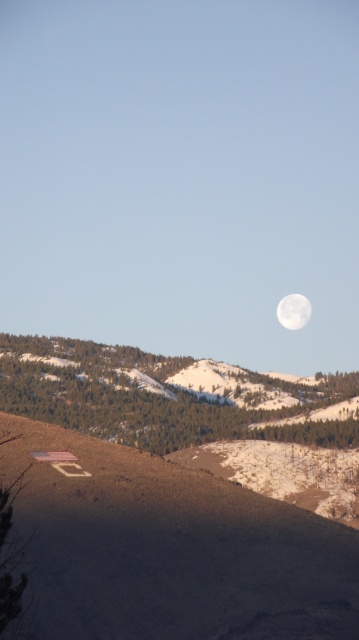
Based on the photo, you are standing at the bottom of the slope in the winter landscape scene. You notice a small American flag on the slope and some brown dirt at lower left. Which object is closer to your current position?

The brown dirt at lower left is located at point (x=165, y=548), which is closer to your current position at the bottom of the slope compared to the American flag on the slope.

You are a photographer setting up a tripod to capture the winter landscape. You want to ensure the brown dirt at lower left and the white glossy moon at upper center are both visible in your shot. Given their relative positions, which object will appear closer to the bottom of your photo?

The brown dirt at lower left will appear closer to the bottom of the photo because it is shorter than the white glossy moon at upper center, which is higher up in the scene.

You are standing at the bottom of the slope in the winter landscape scene. You see two points marked in the image. One is at coordinates point (179, 564) and the other is at point (294, 292). Which point is closer to you?

Point (179, 564) is in front of point (294, 292), so the point at (179, 564) is closer to you.